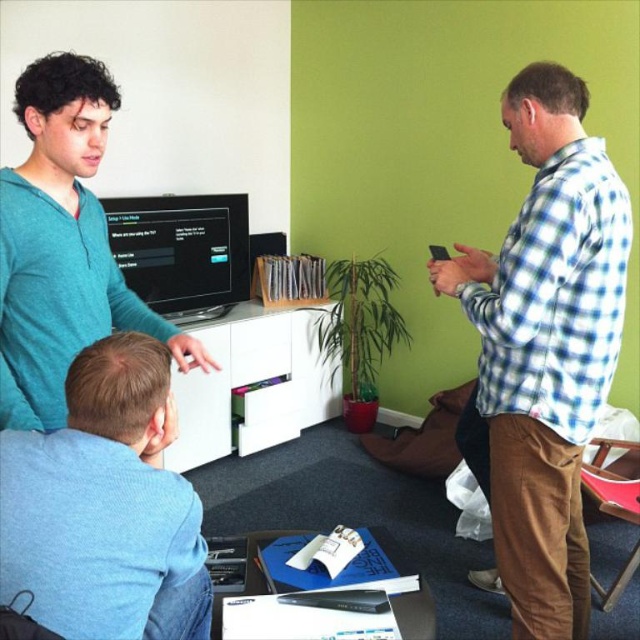
Is point (534, 628) closer to viewer compared to point (164, 260)?

Yes, it is.

Is point (520, 241) more distant than point (196, 200)?

No.

Find the location of a particular element. This screenshot has height=640, width=640. blue checkered shirt at right is located at coordinates (545, 348).

I want to click on blue checkered shirt at right, so click(x=545, y=348).

Is blue checkered shirt at right shorter than teal soft sweater at upper left?

In fact, blue checkered shirt at right may be taller than teal soft sweater at upper left.

Identify the location of blue checkered shirt at right. (545, 348).

This screenshot has height=640, width=640. Describe the element at coordinates (106, 506) in the screenshot. I see `light blue cotton shirt at lower left` at that location.

Who is more distant from viewer, [147,620] or [45,157]?

Point [45,157]

Identify the location of light blue cotton shirt at lower left. The width and height of the screenshot is (640, 640). (106, 506).